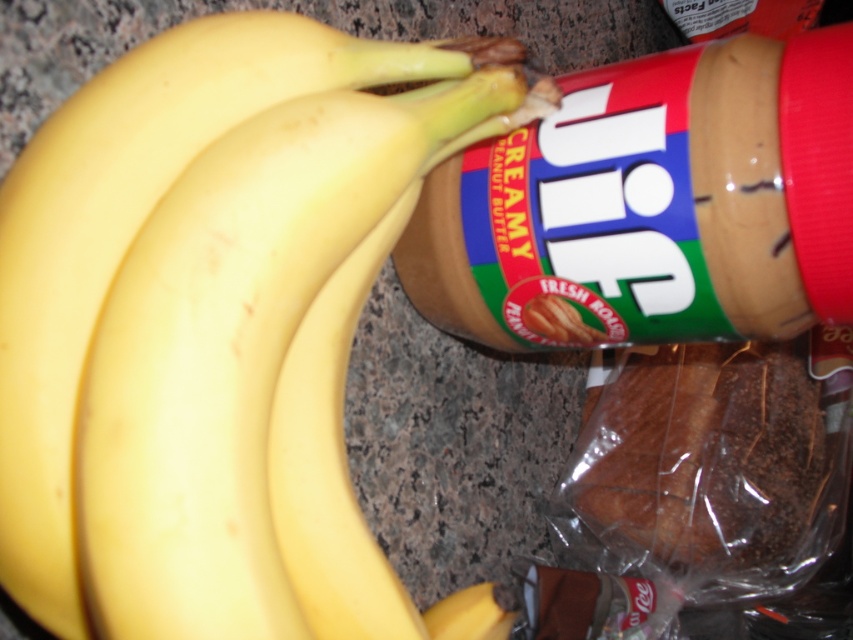
Question: Is yellow matte bananas at left to the left of brown/crumbly bread at right from the viewer's perspective?

Choices:
 (A) yes
 (B) no

Answer: (A)

Question: Can you confirm if yellow matte bananas at left is thinner than brown/crumbly bread at right?

Choices:
 (A) no
 (B) yes

Answer: (B)

Question: Which point appears farthest from the camera in this image?

Choices:
 (A) (606, 410)
 (B) (309, 515)

Answer: (A)

Question: Where is yellow matte bananas at left located in relation to brown/crumbly bread at right in the image?

Choices:
 (A) above
 (B) below

Answer: (A)

Question: Among these objects, which one is nearest to the camera?

Choices:
 (A) yellow matte bananas at left
 (B) brown/crumbly bread at right

Answer: (A)